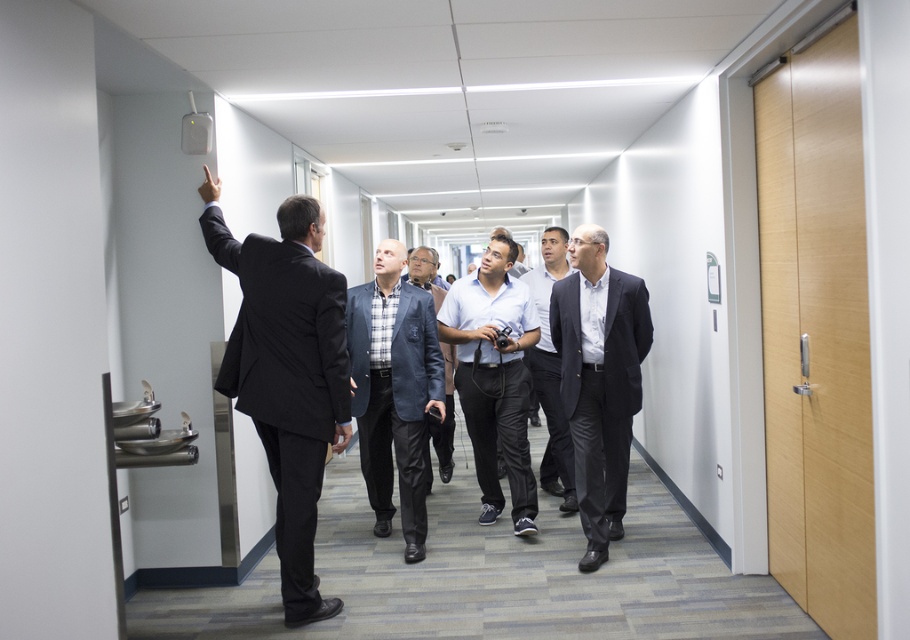
Which is above, white cotton shirt at center or dark blue textured jacket at center?

white cotton shirt at center is above.

Can you confirm if white cotton shirt at center is smaller than dark blue textured jacket at center?

No.

Who is more forward, (443,317) or (445,387)?

Positioned in front is point (443,317).

I want to click on white cotton shirt at center, so click(494, 378).

Is dark suit at upper left further to the viewer compared to dark blue textured jacket at center?

No, dark suit at upper left is closer to the viewer.

Who is higher up, dark suit at upper left or dark blue textured jacket at center?

dark suit at upper left

Is point (396, 348) farther from viewer compared to point (413, 253)?

No.

At what (x,y) coordinates should I click in order to perform the action: click on dark suit at upper left. Please return your answer as a coordinate pair (x, y). The height and width of the screenshot is (640, 910). Looking at the image, I should click on (331, 385).

The image size is (910, 640). What do you see at coordinates (331, 385) in the screenshot?
I see `dark suit at upper left` at bounding box center [331, 385].

Who is more forward, (306, 387) or (486, 477)?

Point (306, 387) is in front.

This screenshot has height=640, width=910. I want to click on dark suit at upper left, so click(331, 385).